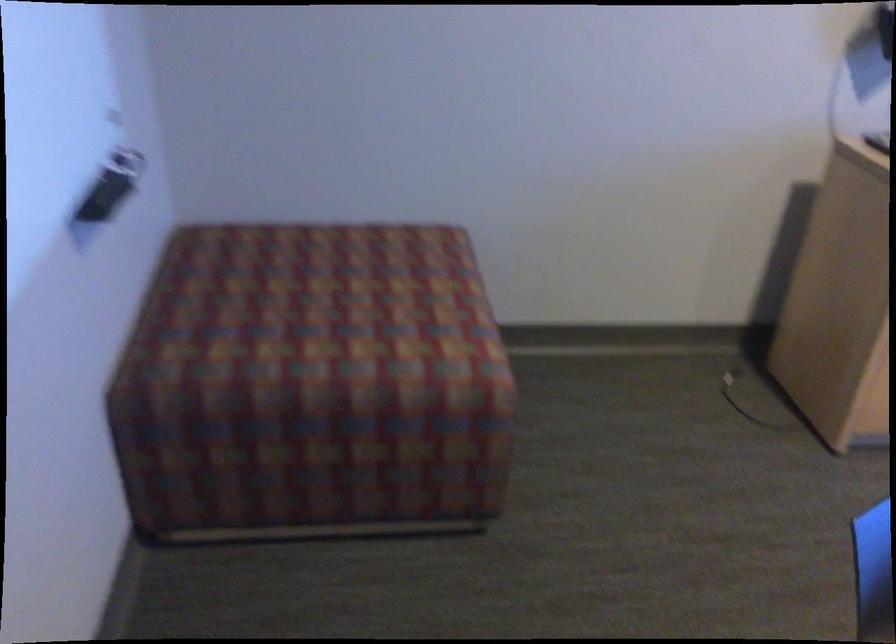
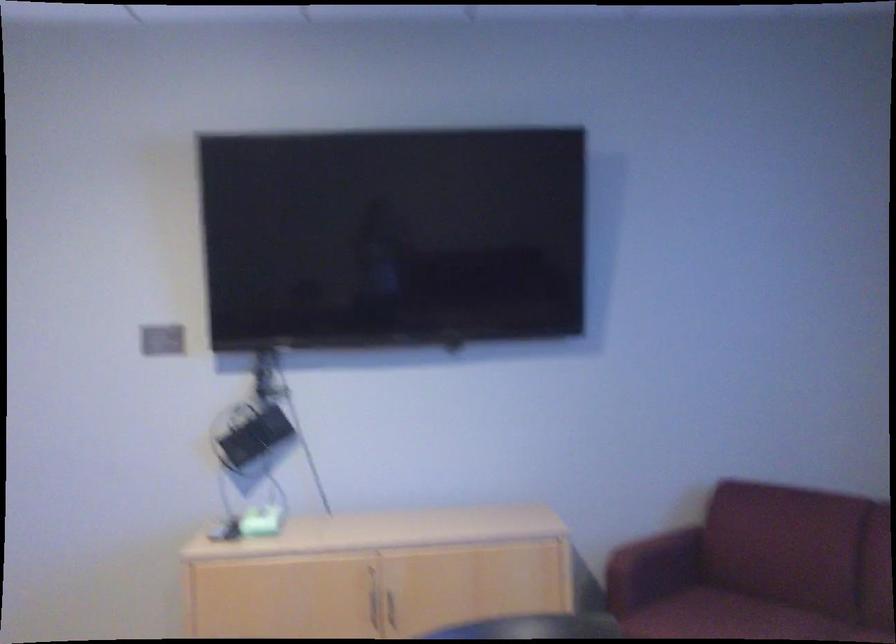
Which direction would the cameraman need to move to produce the second image?

The movement direction of the cameraman is right, backward.